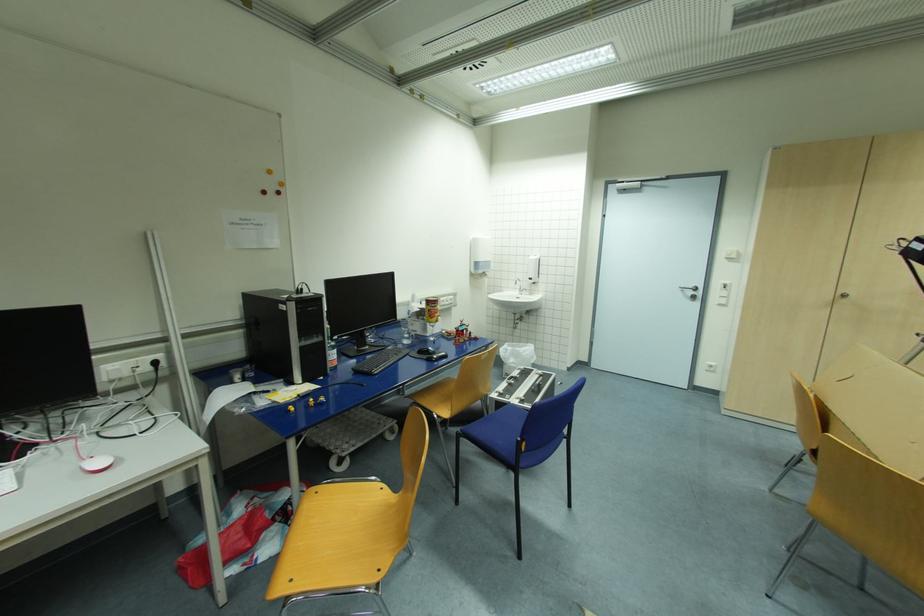
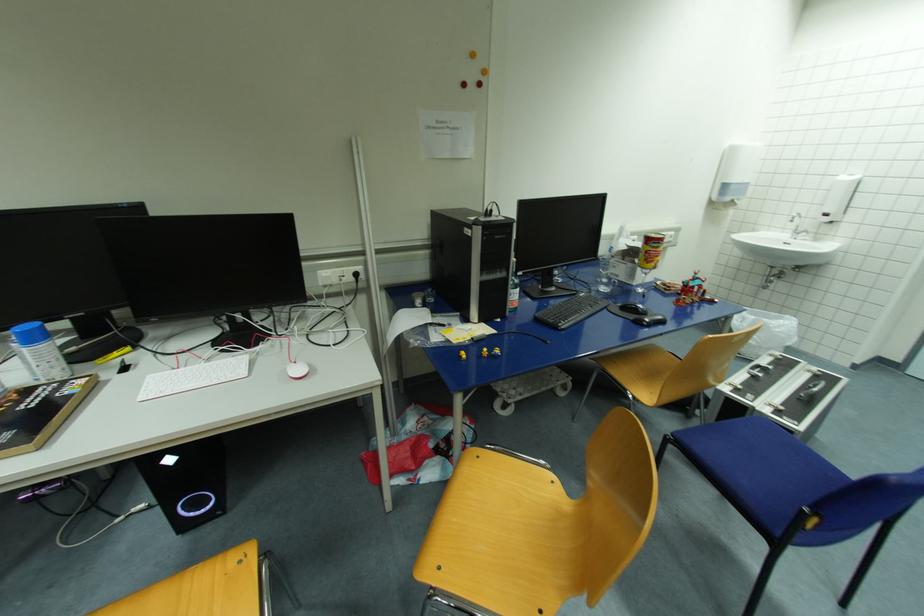
Locate, in the second image, the point that corresponds to (433,302) in the first image.

(653, 241)